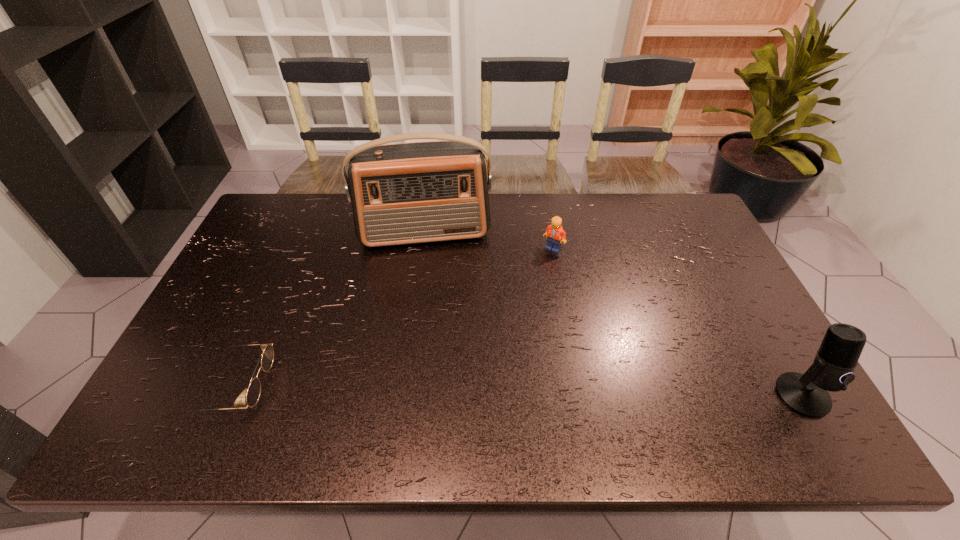
At what (x,y) coordinates should I click in order to perform the action: click on the leftmost object. Please return your answer as a coordinate pair (x, y). Image resolution: width=960 pixels, height=540 pixels. Looking at the image, I should click on (253, 393).

The width and height of the screenshot is (960, 540). Identify the location of the shortest object. (253, 393).

This screenshot has height=540, width=960. Identify the location of microphone. (832, 370).

Find the location of a particular element. the rightmost object is located at coordinates (832, 370).

The height and width of the screenshot is (540, 960). I want to click on the second object from right to left, so click(556, 235).

Where is `Lego`? The width and height of the screenshot is (960, 540). Lego is located at coordinates (556, 235).

Find the location of a particular element. The width and height of the screenshot is (960, 540). the tallest object is located at coordinates (419, 192).

Locate an element on the screen. Image resolution: width=960 pixels, height=540 pixels. radio receiver is located at coordinates (419, 192).

Where is `vacant space located on the front lenses of the sunglasses`? Image resolution: width=960 pixels, height=540 pixels. vacant space located on the front lenses of the sunglasses is located at coordinates (294, 387).

Image resolution: width=960 pixels, height=540 pixels. I want to click on vacant space situated on the front-facing side of the third tallest object, so click(x=549, y=266).